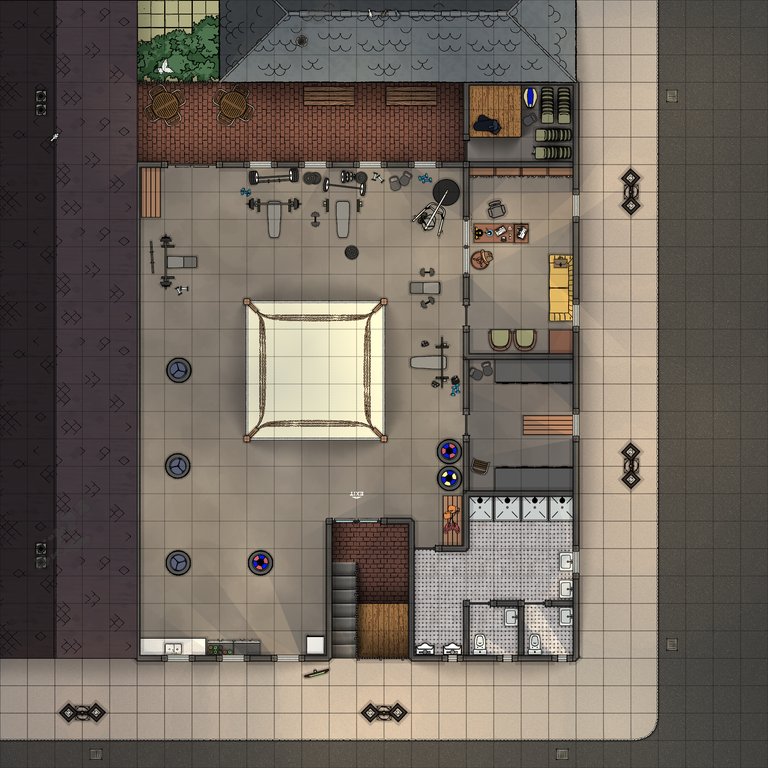
This screenshot has width=768, height=768. I want to click on toilet/urinals, so click(480, 640), click(537, 644), click(448, 647), click(419, 649).